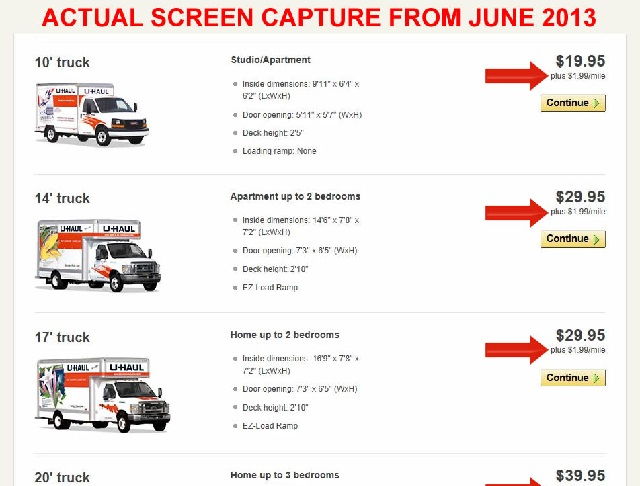
The height and width of the screenshot is (486, 640). In order to click on hood in this screenshot , I will do `click(118, 115)`, `click(124, 260)`, `click(131, 401)`.